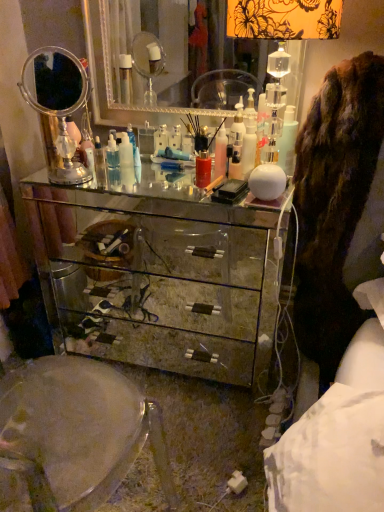
Locate an element on the screen. This screenshot has width=384, height=512. silver/metallic mirror at left, positioned as the second mirror in right-to-left order is located at coordinates (57, 103).

Image resolution: width=384 pixels, height=512 pixels. What do you see at coordinates (284, 19) in the screenshot?
I see `translucent glass lampshade at upper right` at bounding box center [284, 19].

Identify the location of brown furry coat at right. The height and width of the screenshot is (512, 384). (338, 207).

Consider the image. Is the position of translucent plastic bottle at center, placed as the first toiletry when sorted from right to left, more distant than that of silver mirrored dresser at center, the 2th mirror from the left?

That is False.

Considering the relative sizes of translucent plastic bottle at center, which ranks as the second toiletry in back-to-front order, and silver mirrored dresser at center, the 2th mirror from the left, in the image provided, is translucent plastic bottle at center, which ranks as the second toiletry in back-to-front order, bigger than silver mirrored dresser at center, the 2th mirror from the left,?

No, translucent plastic bottle at center, which ranks as the second toiletry in back-to-front order, is not bigger than silver mirrored dresser at center, the 2th mirror from the left.

I want to click on mirror behind the translucent plastic bottle at center, which ranks as the second toiletry in back-to-front order, so click(158, 68).

Is translucent plastic bottle at center, placed as the first toiletry when sorted from right to left, situated inside silver mirrored dresser at center, the 2th mirror from the left, or outside?

translucent plastic bottle at center, placed as the first toiletry when sorted from right to left, is not inside silver mirrored dresser at center, the 2th mirror from the left, it's outside.

From the image's perspective, is clear plastic bottle at center, placed as the 2th toiletry when sorted from front to back, above translucent glass lampshade at upper right?

Actually, clear plastic bottle at center, placed as the 2th toiletry when sorted from front to back, appears below translucent glass lampshade at upper right in the image.

Can translucent glass lampshade at upper right be found inside clear plastic bottle at center, the 1th toiletry from the back?

No, translucent glass lampshade at upper right is located outside of clear plastic bottle at center, the 1th toiletry from the back.

Is clear plastic bottle at center, which is the 2th toiletry from right to left, looking in the opposite direction of translucent glass lampshade at upper right?

No, clear plastic bottle at center, which is the 2th toiletry from right to left, is not facing away from translucent glass lampshade at upper right.

Does clear plastic bottle at center, which is the 2th toiletry from right to left, have a smaller size compared to mirrored glass chest of drawers at center?

Correct, clear plastic bottle at center, which is the 2th toiletry from right to left, occupies less space than mirrored glass chest of drawers at center.

In terms of height, does clear plastic bottle at center, placed as the 2th toiletry when sorted from front to back, look taller or shorter compared to mirrored glass chest of drawers at center?

Considering their sizes, clear plastic bottle at center, placed as the 2th toiletry when sorted from front to back, has less height than mirrored glass chest of drawers at center.

Is clear plastic bottle at center, which is the 2th toiletry from right to left, situated inside mirrored glass chest of drawers at center or outside?

clear plastic bottle at center, which is the 2th toiletry from right to left, is outside mirrored glass chest of drawers at center.

Is there a large distance between clear plastic bottle at center, the 1th toiletry from the back, and mirrored glass chest of drawers at center?

No, clear plastic bottle at center, the 1th toiletry from the back, is in close proximity to mirrored glass chest of drawers at center.

Is silver mirrored dresser at center, the 2th mirror from the left, in contact with translucent plastic bottle at center, which ranks as the second toiletry in back-to-front order?

There is a gap between silver mirrored dresser at center, the 2th mirror from the left, and translucent plastic bottle at center, which ranks as the second toiletry in back-to-front order.

Who is taller, silver mirrored dresser at center, the 1th mirror viewed from the right, or translucent plastic bottle at center, which ranks as the second toiletry in back-to-front order?

Standing taller between the two is silver mirrored dresser at center, the 1th mirror viewed from the right.

From a real-world perspective, is silver mirrored dresser at center, the 2th mirror from the left, positioned under translucent plastic bottle at center, placed as the first toiletry when sorted from right to left, based on gravity?

No, from a real-world perspective, silver mirrored dresser at center, the 2th mirror from the left, is not under translucent plastic bottle at center, placed as the first toiletry when sorted from right to left.

Is brown furry coat at right to the right of silver mirrored dresser at center, the 2th mirror from the left, from the viewer's perspective?

Yes.

From a real-world perspective, which is physically below, brown furry coat at right or silver mirrored dresser at center, the 2th mirror from the left?

From a 3D spatial view, brown furry coat at right is below.

How different are the orientations of brown furry coat at right and silver mirrored dresser at center, the 2th mirror from the left, in degrees?

7.16 degrees separate the facing orientations of brown furry coat at right and silver mirrored dresser at center, the 2th mirror from the left.

Is brown furry coat at right positioned with its back to silver mirrored dresser at center, the 1th mirror viewed from the right?

No, brown furry coat at right is not facing the opposite direction of silver mirrored dresser at center, the 1th mirror viewed from the right.

Can you confirm if translucent glass lampshade at upper right is bigger than translucent plastic bottle at center, placed as the first toiletry when sorted from right to left?

Correct, translucent glass lampshade at upper right is larger in size than translucent plastic bottle at center, placed as the first toiletry when sorted from right to left.

Which is in front, point (243, 13) or point (242, 147)?

The point (243, 13) is closer.

Considering the relative sizes of translucent glass lampshade at upper right and translucent plastic bottle at center, placed as the first toiletry when sorted from right to left, in the image provided, is translucent glass lampshade at upper right taller than translucent plastic bottle at center, placed as the first toiletry when sorted from right to left,?

Yes, translucent glass lampshade at upper right is taller than translucent plastic bottle at center, placed as the first toiletry when sorted from right to left.

In terms of width, does silver/metallic mirror at left, the 1th mirror positioned from the left, look wider or thinner when compared to clear plastic bottle at center, marked as the first toiletry in a left-to-right arrangement?

Considering their sizes, silver/metallic mirror at left, the 1th mirror positioned from the left, looks broader than clear plastic bottle at center, marked as the first toiletry in a left-to-right arrangement.

How many degrees apart are the facing directions of silver/metallic mirror at left, positioned as the second mirror in right-to-left order, and clear plastic bottle at center, which is the 2th toiletry from right to left?

3.51 degrees.

Between silver/metallic mirror at left, positioned as the second mirror in right-to-left order, and clear plastic bottle at center, the 1th toiletry from the back, which one appears on the left side from the viewer's perspective?

silver/metallic mirror at left, positioned as the second mirror in right-to-left order, is more to the left.

Does silver/metallic mirror at left, the 1th mirror positioned from the left, contain clear plastic bottle at center, the 1th toiletry from the back?

Actually, clear plastic bottle at center, the 1th toiletry from the back, is outside silver/metallic mirror at left, the 1th mirror positioned from the left.

From a real-world perspective, which toiletry is the 1st one underneath the silver mirrored dresser at center, the 1th mirror viewed from the right? Please provide its 2D coordinates.

[(249, 146)]

Starting from the translucent glass lampshade at upper right, which toiletry is the 2nd one behind? Please provide its 2D coordinates.

[(125, 150)]

When comparing their distances from silver mirrored dresser at center, the 2th mirror from the left, does mirrored glass chest of drawers at center or silver/metallic mirror at left, positioned as the second mirror in right-to-left order, seem further?

Among the two, mirrored glass chest of drawers at center is located further to silver mirrored dresser at center, the 2th mirror from the left.

Based on their spatial positions, is brown furry coat at right or translucent plastic bottle at center, the 2th toiletry when ordered from left to right, closer to mirrored glass chest of drawers at center?

Among the two, brown furry coat at right is located nearer to mirrored glass chest of drawers at center.

Looking at the image, which one is located closer to mirrored glass chest of drawers at center, brown furry coat at right or silver/metallic mirror at left, the 1th mirror positioned from the left?

silver/metallic mirror at left, the 1th mirror positioned from the left, lies closer to mirrored glass chest of drawers at center than the other object.

Estimate the real-world distances between objects in this image. Which object is closer to translucent glass lampshade at upper right, silver/metallic mirror at left, the 1th mirror positioned from the left, or silver mirrored dresser at center, the 2th mirror from the left?

silver/metallic mirror at left, the 1th mirror positioned from the left, is positioned closer to the anchor translucent glass lampshade at upper right.

Which object lies further to the anchor point translucent plastic bottle at center, the 2th toiletry when ordered from left to right, mirrored glass chest of drawers at center or translucent glass lampshade at upper right?

Based on the image, mirrored glass chest of drawers at center appears to be further to translucent plastic bottle at center, the 2th toiletry when ordered from left to right.

When comparing their distances from brown furry coat at right, does translucent glass lampshade at upper right or clear plastic bottle at center, marked as the first toiletry in a left-to-right arrangement, seem further?

Based on the image, clear plastic bottle at center, marked as the first toiletry in a left-to-right arrangement, appears to be further to brown furry coat at right.

Consider the image. From the image, which object appears to be farther from silver/metallic mirror at left, positioned as the second mirror in right-to-left order, silver mirrored dresser at center, the 1th mirror viewed from the right, or translucent plastic bottle at center, acting as the first toiletry starting from the front?

silver mirrored dresser at center, the 1th mirror viewed from the right.

Considering their positions, is mirrored glass chest of drawers at center positioned further to silver/metallic mirror at left, positioned as the second mirror in right-to-left order, than translucent plastic bottle at center, acting as the first toiletry starting from the front?

Among the two, translucent plastic bottle at center, acting as the first toiletry starting from the front, is located further to silver/metallic mirror at left, positioned as the second mirror in right-to-left order.

Locate an element on the screen. Image resolution: width=384 pixels, height=512 pixels. chest of drawers between silver/metallic mirror at left, the 1th mirror positioned from the left, and translucent plastic bottle at center, the 2th toiletry when ordered from left to right is located at coordinates (158, 277).

The height and width of the screenshot is (512, 384). I want to click on the chest of drawers situated between silver/metallic mirror at left, the 1th mirror positioned from the left, and brown furry coat at right from left to right, so click(158, 277).

The height and width of the screenshot is (512, 384). I want to click on toiletry between silver/metallic mirror at left, the 1th mirror positioned from the left, and translucent plastic bottle at center, the 2th toiletry when ordered from left to right, in the horizontal direction, so click(125, 150).

The width and height of the screenshot is (384, 512). Identify the location of toiletry between clear plastic bottle at center, the 1th toiletry from the back, and brown furry coat at right from left to right. (249, 146).